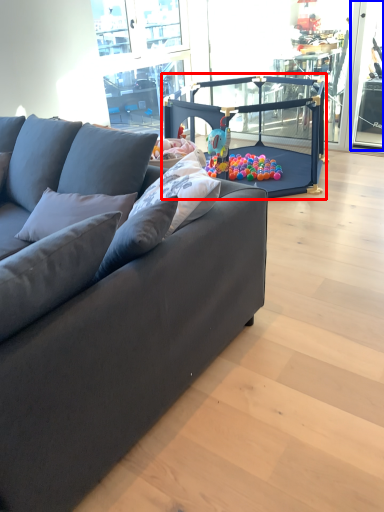
Question: Which object is closer to the camera taking this photo, baby carriage (highlighted by a red box) or window screen (highlighted by a blue box)?

Choices:
 (A) baby carriage
 (B) window screen

Answer: (A)